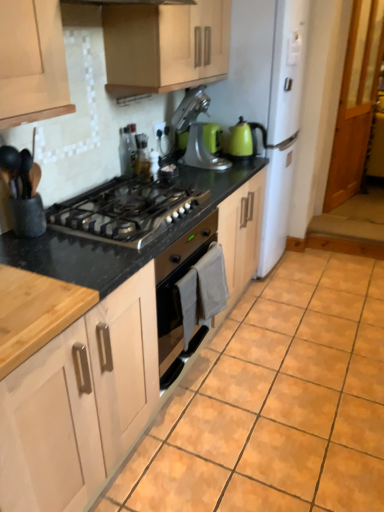
Locate an element on the screen. The image size is (384, 512). spots to the right of translucent glass bottle at upper center, which is counted as the 3th appliance, starting from the back is located at coordinates (187, 177).